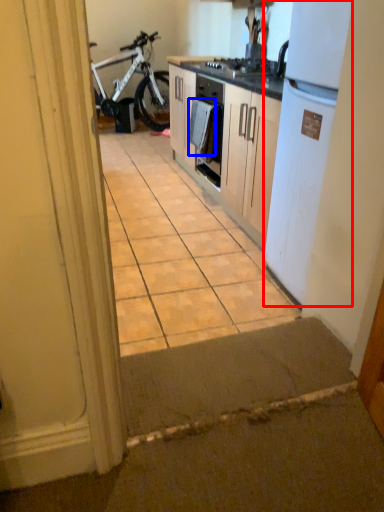
Question: Which point is closer to the camera, refrigerator (highlighted by a red box) or towel/napkin (highlighted by a blue box)?

Choices:
 (A) refrigerator
 (B) towel/napkin

Answer: (A)